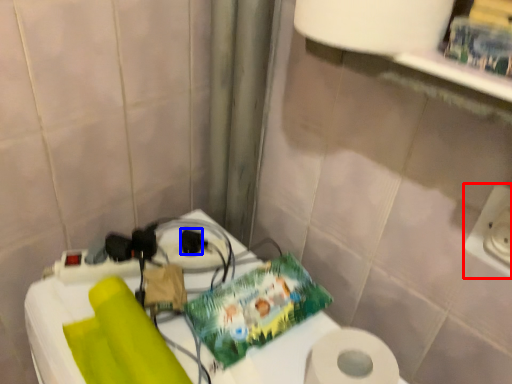
Question: Among these objects, which one is nearest to the camera, electric outlet (highlighted by a red box) or socket (highlighted by a blue box)?

Choices:
 (A) electric outlet
 (B) socket

Answer: (A)